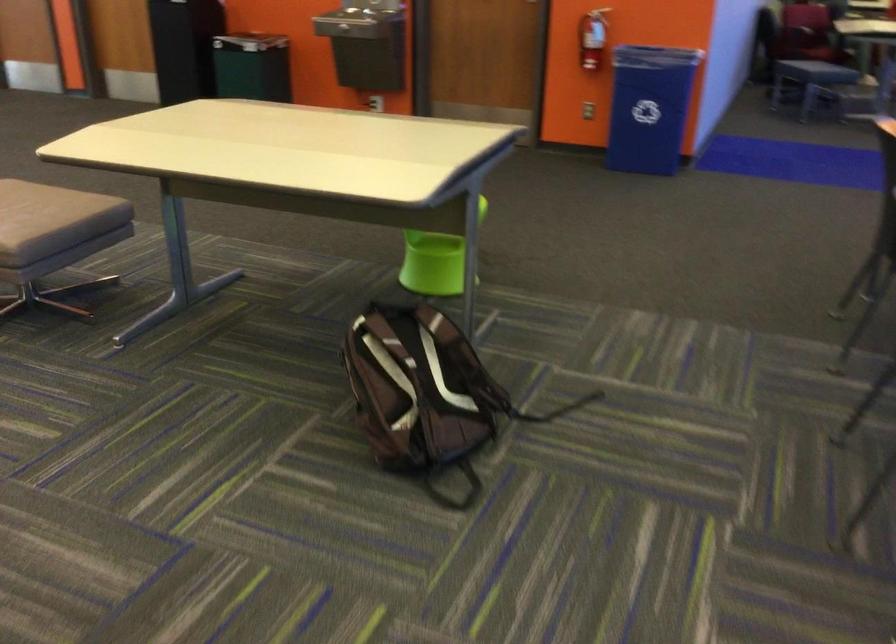
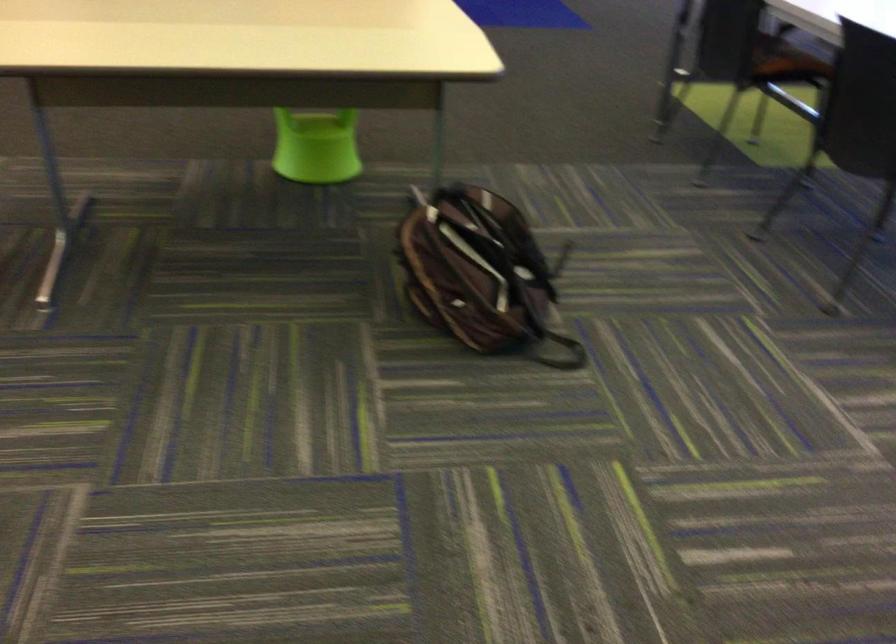
The point at (x=274, y=178) is marked in the first image. Where is the corresponding point in the second image?

(322, 67)